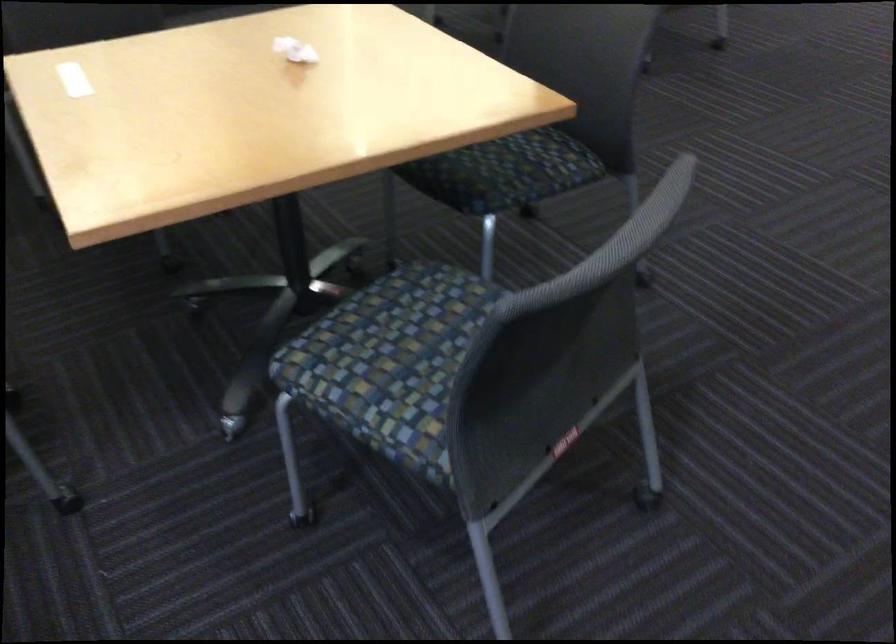
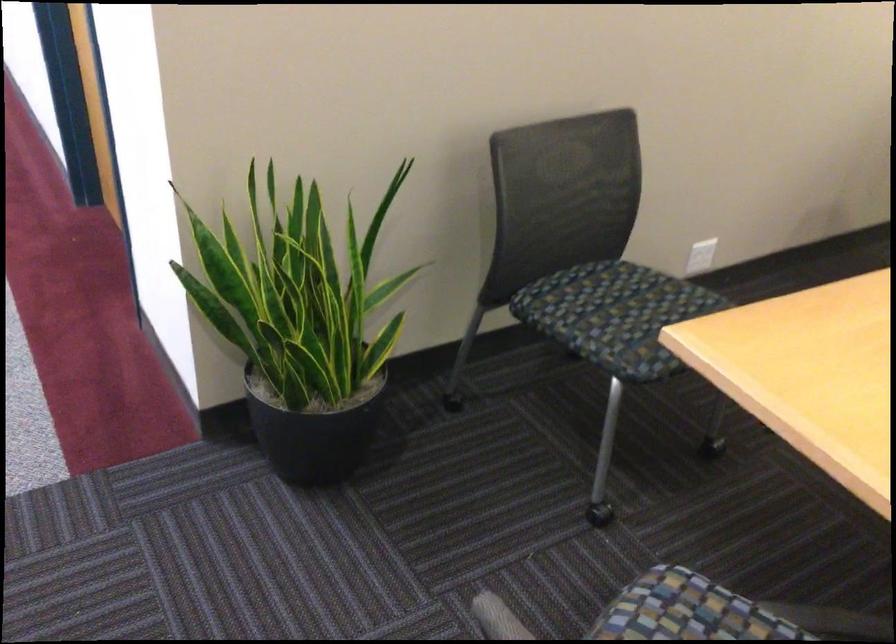
How did the camera likely rotate?

The camera's rotation is toward left-down.